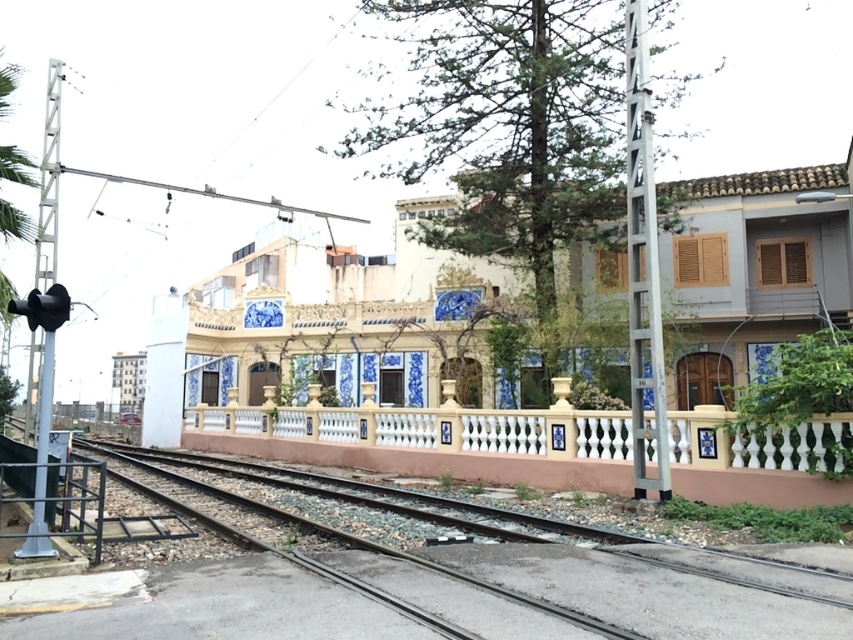
You are a maintenance worker inspecting the railway tracks. You notice the smooth concrete tracks at center and the smooth concrete rail at center. Which one is nearer to you?

The smooth concrete tracks at center are closer to the viewer than the smooth concrete rail at center.

You are a railway inspector checking the alignment of the tracks and rail. According to the image, which object is shorter between the smooth concrete tracks at center and the smooth concrete rail at center?

The smooth concrete tracks at center is not as tall as the smooth concrete rail at center, so the smooth concrete tracks at center is shorter.